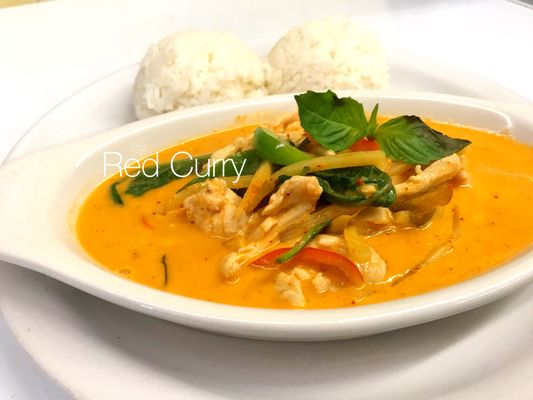
I want to click on bowl, so click(x=74, y=217).